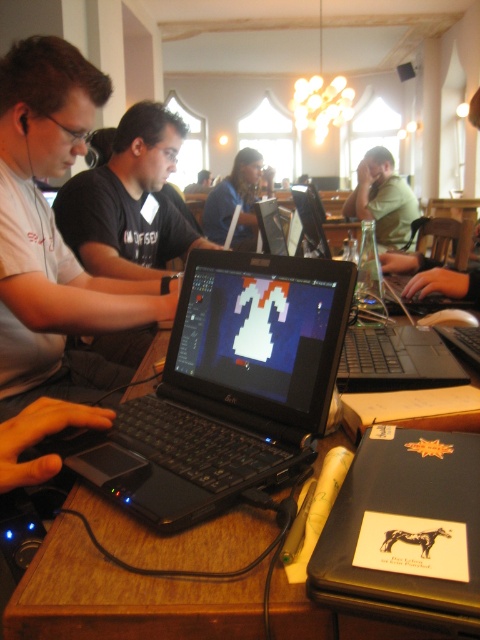
Question: Does wooden table at center appear over matte white shirt at left?

Choices:
 (A) yes
 (B) no

Answer: (B)

Question: Estimate the real-world distances between objects in this image. Which object is closer to the matte white shirt at left?

Choices:
 (A) matte black laptop at center
 (B) black plastic laptop at center
 (C) wooden table at center

Answer: (B)

Question: Which object is positioned closest to the matte black laptop at center?

Choices:
 (A) wooden table at center
 (B) black matte shirt at upper left

Answer: (B)

Question: Does black matte shirt at upper left have a lesser width compared to black glossy laptop at center?

Choices:
 (A) yes
 (B) no

Answer: (A)

Question: Which of the following is the closest to the observer?

Choices:
 (A) (242, 540)
 (B) (280, 339)

Answer: (A)

Question: Is the position of wooden table at center more distant than that of matte black laptop at center?

Choices:
 (A) yes
 (B) no

Answer: (B)